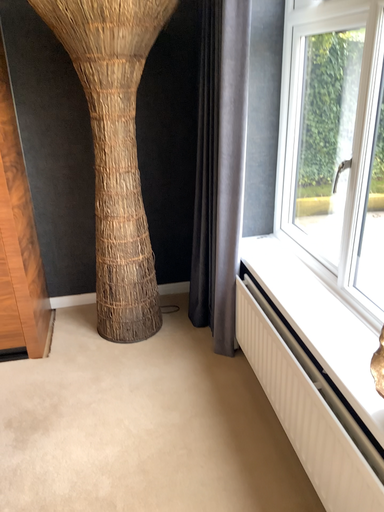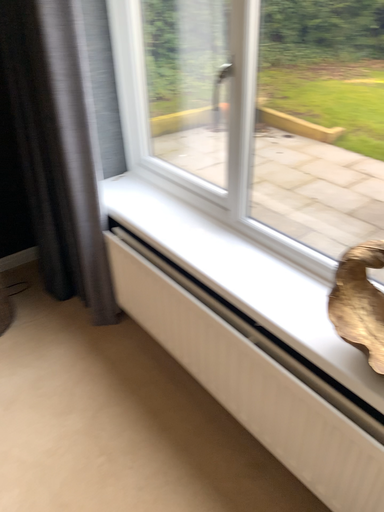
Question: How did the camera likely rotate when shooting the video?

Choices:
 (A) rotated left
 (B) rotated right

Answer: (B)